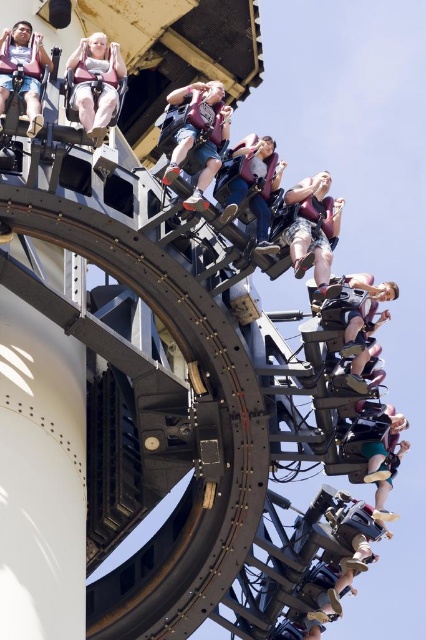
Question: Does matte black shirt at center lie in front of matte black shorts at center?

Choices:
 (A) yes
 (B) no

Answer: (A)

Question: Is pink fabric seat at upper left to the left of matte black harness at center from the viewer's perspective?

Choices:
 (A) no
 (B) yes

Answer: (B)

Question: Can you confirm if matte black shorts at center is positioned below matte black harness at center?

Choices:
 (A) yes
 (B) no

Answer: (B)

Question: Which point is closer to the camera?

Choices:
 (A) matte black shirt at center
 (B) matte black harness at center
 (C) pink fabric seat at upper left

Answer: (C)

Question: Estimate the real-world distances between objects in this image. Which object is closer to the matte black shorts at center?

Choices:
 (A) pink fabric seat at upper left
 (B) matte black harness at center
 (C) matte black shirt at center

Answer: (B)

Question: Which point appears closest to the camera in this image?

Choices:
 (A) (365, 388)
 (B) (22, 35)
 (C) (77, 108)
 (D) (271, 243)

Answer: (C)